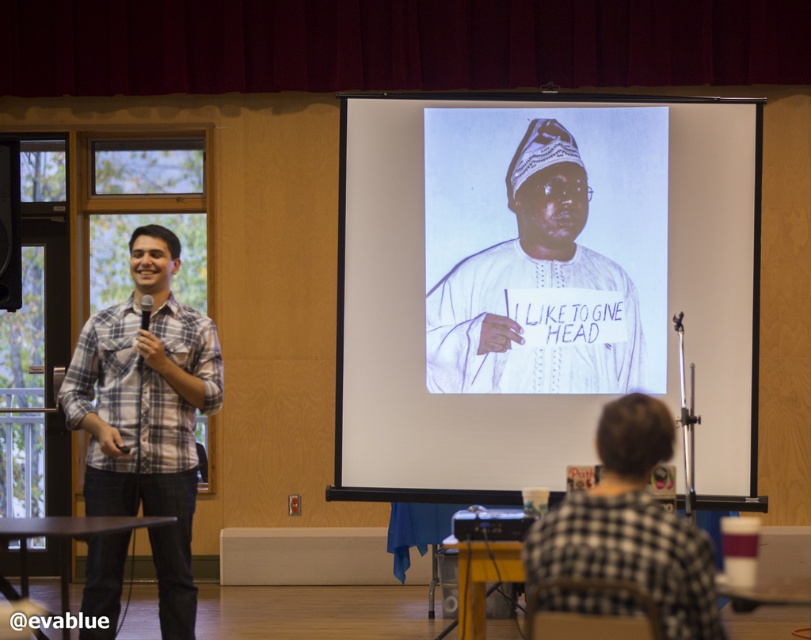
Who is shorter, white matte clothing at center or black checkered shirt at lower right?

Standing shorter between the two is black checkered shirt at lower right.

Does white matte clothing at center have a smaller size compared to black checkered shirt at lower right?

No, white matte clothing at center is not smaller than black checkered shirt at lower right.

Between point (449, 369) and point (569, 573), which one is positioned behind?

Positioned behind is point (449, 369).

The width and height of the screenshot is (811, 640). Identify the location of white matte clothing at center. (531, 288).

Is plaid shirt at left closer to the viewer compared to matte plaid shirt at left?

That is True.

Image resolution: width=811 pixels, height=640 pixels. In order to click on plaid shirt at left in this screenshot , I will do (147, 413).

Can you confirm if white matte clothing at center is wider than black plastic projector at lower center?

Correct, the width of white matte clothing at center exceeds that of black plastic projector at lower center.

Locate an element on the screen. white matte clothing at center is located at coordinates (531, 288).

In order to click on white matte clothing at center in this screenshot , I will do `click(531, 288)`.